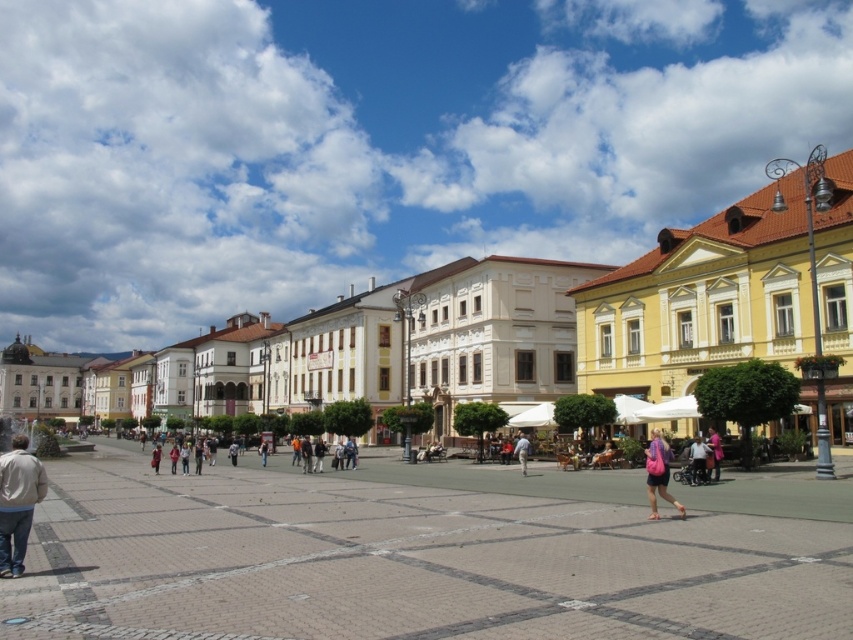
You are standing in the urban square and see the yellow painted building at center and the pink fabric bag at lower right. From your perspective, which object is positioned to the right side?

The yellow painted building at center is positioned to the right of the pink fabric bag at lower right, so the yellow painted building at center is on the right side.

You are standing in the urban square and see a light beige jacket at lower left and a pink fabric bag at lower right. Which object is wider?

The pink fabric bag at lower right is wider than the light beige jacket at lower left.